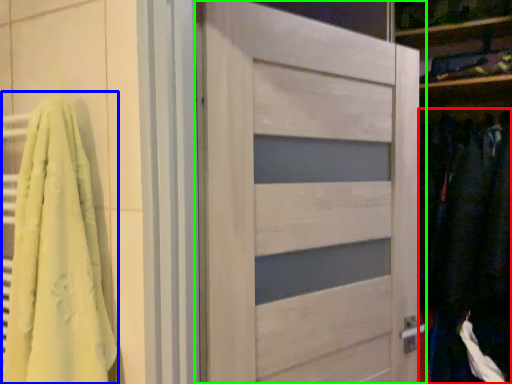
Question: Estimate the real-world distances between objects in this image. Which object is farther from clothing (highlighted by a red box), bath towel (highlighted by a blue box) or door (highlighted by a green box)?

Choices:
 (A) bath towel
 (B) door

Answer: (A)